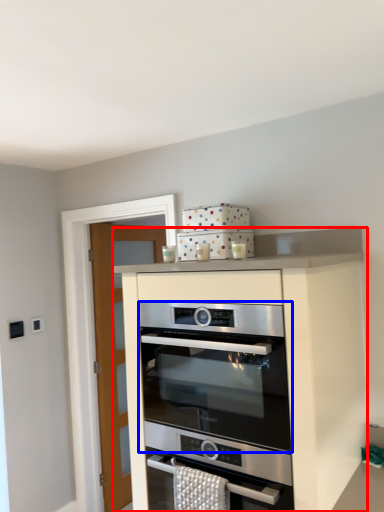
Question: Which point is closer to the camera, cabinetry (highlighted by a red box) or oven (highlighted by a blue box)?

Choices:
 (A) cabinetry
 (B) oven

Answer: (A)